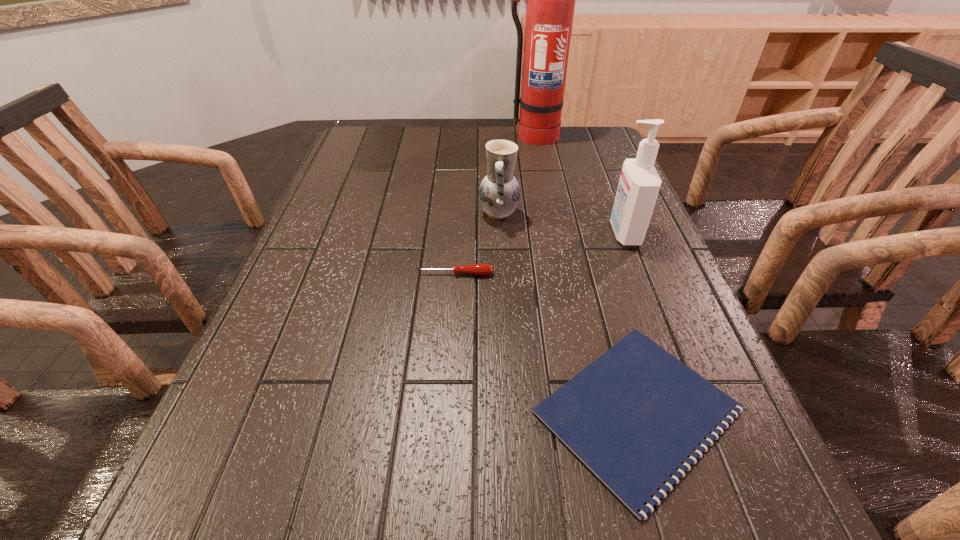
Locate an element on the screen. vacant area that satisfies the following two spatial constraints: 1. on the label side of the nearest object; 2. on the right side of the tallest object is located at coordinates (586, 411).

You are a GUI agent. You are given a task and a screenshot of the screen. Output one action in this format:
    pyautogui.click(x=<x>, y=<y>)
    Task: Click on the blank area in the image that satisfies the following two spatial constraints: 1. on the label side of the tallest object; 2. on either side of the pottery
    The image size is (960, 540).
    Given the screenshot: What is the action you would take?
    pyautogui.click(x=547, y=213)

This screenshot has height=540, width=960. I want to click on blank space that satisfies the following two spatial constraints: 1. on the label side of the tallest object; 2. on either side of the third shortest object, so click(x=547, y=213).

At what (x,y) coordinates should I click in order to perform the action: click on free space that satisfies the following two spatial constraints: 1. on the back side of the shortest object; 2. on either side of the pottery. Please return your answer as a coordinate pair (x, y). The width and height of the screenshot is (960, 540). Looking at the image, I should click on (580, 213).

Image resolution: width=960 pixels, height=540 pixels. In order to click on vacant space that satisfies the following two spatial constraints: 1. on the label side of the fire extinguisher; 2. on either side of the pottery in this screenshot , I will do `click(547, 213)`.

The image size is (960, 540). In order to click on free spot that satisfies the following two spatial constraints: 1. on the label side of the farthest object; 2. on the right side of the shortest object in this screenshot , I will do `click(586, 411)`.